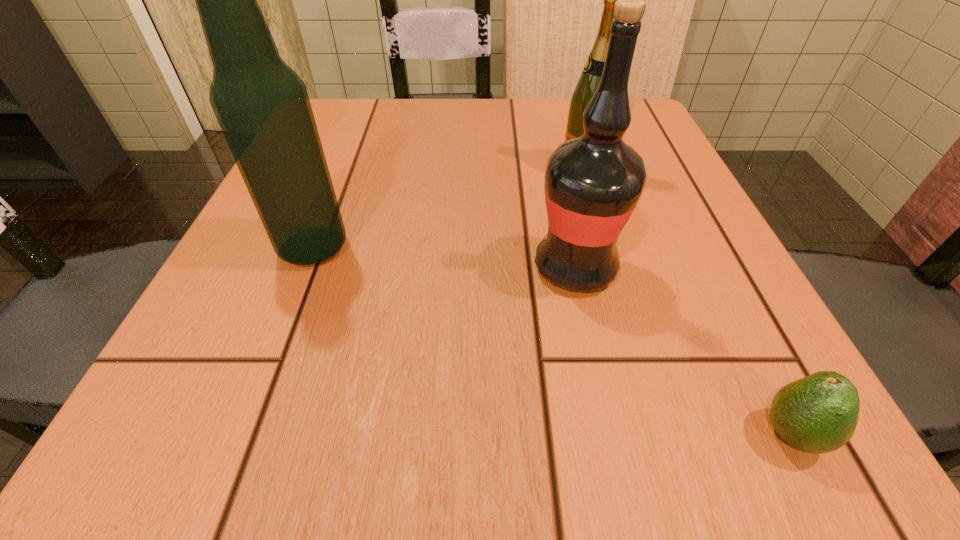
Image resolution: width=960 pixels, height=540 pixels. In order to click on the tallest object in this screenshot , I will do `click(262, 106)`.

The image size is (960, 540). Identify the location of alcohol. (262, 106).

In order to click on the nearer wine bottle in this screenshot , I will do `click(593, 182)`.

Find the location of a particular element. The width and height of the screenshot is (960, 540). the farthest object is located at coordinates (589, 80).

In order to click on the shortest object in this screenshot , I will do `click(817, 414)`.

Identify the location of the rightmost object. (x=817, y=414).

Locate an element on the screen. This screenshot has height=540, width=960. vacant space located on the right of the alcohol is located at coordinates (400, 247).

In order to click on free space located 0.300m on the back of the nearer wine bottle in this screenshot , I will do `click(548, 142)`.

At what (x,y) coordinates should I click in order to perform the action: click on vacant space located on the front-facing side of the farthest object. Please return your answer as a coordinate pair (x, y). The height and width of the screenshot is (540, 960). Looking at the image, I should click on (465, 168).

Where is `free region located 0.390m on the front-facing side of the farthest object`? This screenshot has height=540, width=960. free region located 0.390m on the front-facing side of the farthest object is located at coordinates (351, 168).